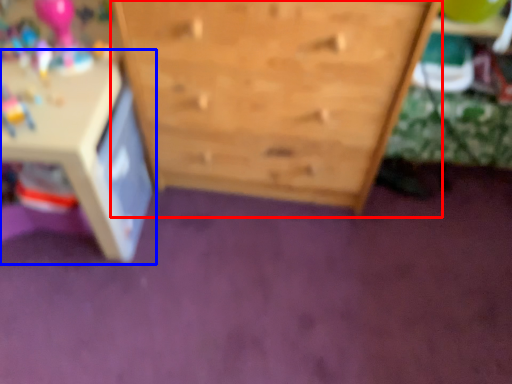
Question: Which object is closer to the camera taking this photo, chest of drawers (highlighted by a red box) or table (highlighted by a blue box)?

Choices:
 (A) chest of drawers
 (B) table

Answer: (A)